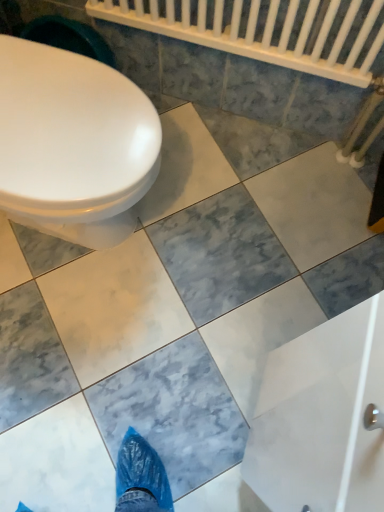
You are a GUI agent. You are given a task and a screenshot of the screen. Output one action in this format:
    pyautogui.click(x=<x>, y=<y>)
    Task: Click on the vacant space in front of white glossy toilet at left
    The height and width of the screenshot is (512, 384).
    Given the screenshot: What is the action you would take?
    pyautogui.click(x=78, y=349)